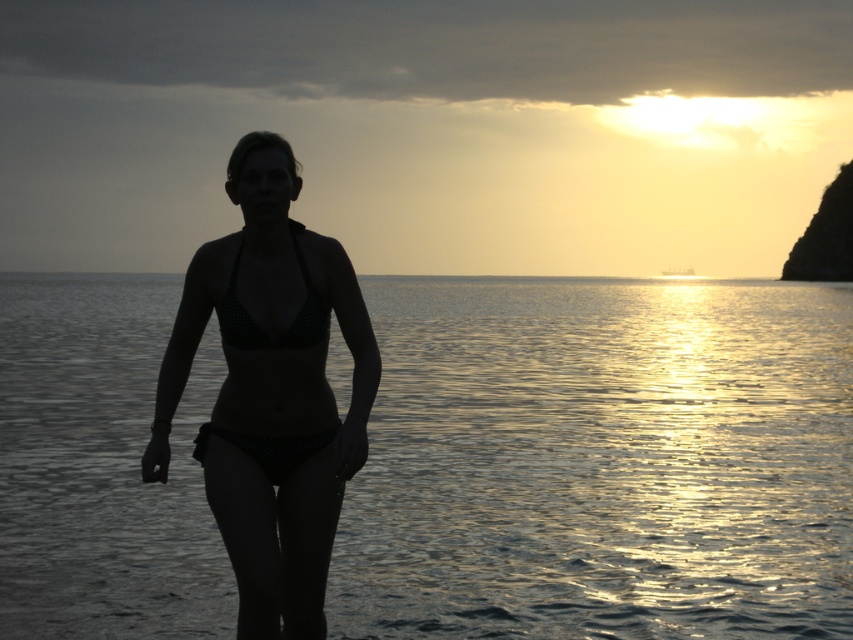
Question: Which point is closer to the camera?

Choices:
 (A) (720, 456)
 (B) (299, 168)
 (C) (281, 552)

Answer: (C)

Question: Is glistening water at center further to the viewer compared to silhouette bikini at center?

Choices:
 (A) no
 (B) yes

Answer: (B)

Question: Which point appears closest to the camera in this image?

Choices:
 (A) (335, 512)
 (B) (236, 164)
 (C) (22, 545)
 (D) (315, 323)

Answer: (B)

Question: Which point is closer to the camera?

Choices:
 (A) black dotted bikini at center
 (B) glistening water at center

Answer: (A)

Question: In this image, where is glistening water at center located relative to black dotted bikini at center?

Choices:
 (A) below
 (B) above

Answer: (B)

Question: Can you confirm if glistening water at center is bigger than black dotted fabric bikini at center?

Choices:
 (A) yes
 (B) no

Answer: (A)